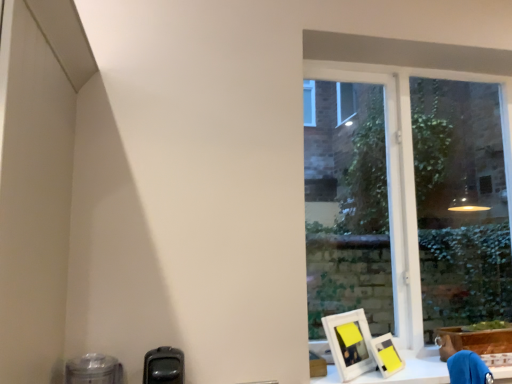
Question: Does transparent glass window at right have a larger size compared to matte yellow picture frame at lower right, which is the 2th picture frame in left-to-right order?

Choices:
 (A) no
 (B) yes

Answer: (B)

Question: Is transparent glass window at right at the left side of matte yellow picture frame at lower right, the 1th picture frame viewed from the right?

Choices:
 (A) no
 (B) yes

Answer: (A)

Question: From a real-world perspective, is transparent glass window at right below matte yellow picture frame at lower right, the 1th picture frame viewed from the right?

Choices:
 (A) no
 (B) yes

Answer: (A)

Question: Is matte yellow picture frame at lower right, the 1th picture frame viewed from the right, located within transparent glass window at right?

Choices:
 (A) no
 (B) yes

Answer: (A)

Question: From a real-world perspective, is transparent glass window at right on matte yellow picture frame at lower right, the 1th picture frame viewed from the right?

Choices:
 (A) no
 (B) yes

Answer: (B)

Question: In the image, is transparent glass window at right positioned in front of or behind brown cardboard box at lower right?

Choices:
 (A) behind
 (B) front

Answer: (A)

Question: Is point (416, 271) closer or farther from the camera than point (499, 337)?

Choices:
 (A) closer
 (B) farther

Answer: (B)

Question: In terms of width, does transparent glass window at right look wider or thinner when compared to brown cardboard box at lower right?

Choices:
 (A) thin
 (B) wide

Answer: (A)

Question: From a real-world perspective, is transparent glass window at right physically located above or below brown cardboard box at lower right?

Choices:
 (A) below
 (B) above

Answer: (B)

Question: From a real-world perspective, is transparent glass window at right above or below white matte workbench at lower right?

Choices:
 (A) above
 (B) below

Answer: (A)

Question: Relative to white matte workbench at lower right, is transparent glass window at right in front or behind?

Choices:
 (A) front
 (B) behind

Answer: (B)

Question: From the image's perspective, is transparent glass window at right above or below white matte workbench at lower right?

Choices:
 (A) below
 (B) above

Answer: (B)

Question: Is point (325, 69) positioned closer to the camera than point (404, 349)?

Choices:
 (A) farther
 (B) closer

Answer: (A)

Question: Considering their positions, is white matte picture frame at lower right, which appears as the 1th picture frame when viewed from the left, located in front of or behind matte yellow picture frame at lower right, which is the 2th picture frame in left-to-right order?

Choices:
 (A) behind
 (B) front

Answer: (B)

Question: Is white matte picture frame at lower right, which is the second picture frame from right to left, to the left or to the right of matte yellow picture frame at lower right, the 1th picture frame viewed from the right, in the image?

Choices:
 (A) left
 (B) right

Answer: (A)